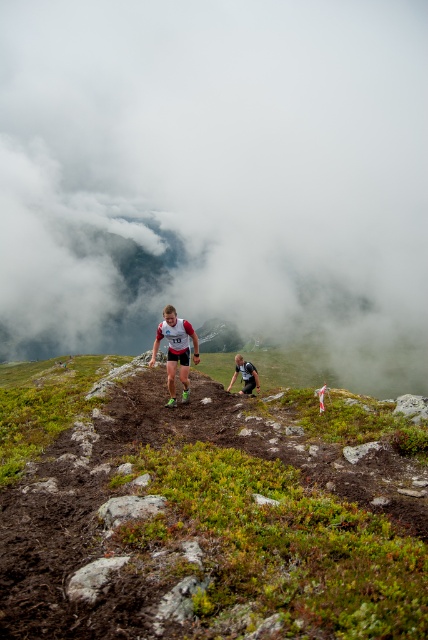
You are a photographer trying to capture a clear shot of the runner in the white mesh shirt at center. Since the black fabric running suit at center is blocking your view, can you move to the right or left to get an unobstructed view?

The white mesh shirt at center is positioned over the black fabric running suit at center, meaning the white mesh shirt is in front. Therefore, moving to either the right or left might not necessarily provide an unobstructed view since the white mesh shirt is already blocking the black fabric running suit. You may need to adjust your angle or move forward instead.